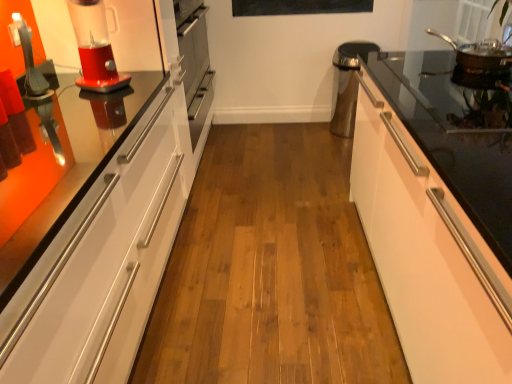
Question: From the image's perspective, is translucent plastic blender at left over stainless steel frying pan at upper right?

Choices:
 (A) no
 (B) yes

Answer: (A)

Question: Is translucent plastic blender at left behind stainless steel frying pan at upper right?

Choices:
 (A) no
 (B) yes

Answer: (A)

Question: Is translucent plastic blender at left to the left of stainless steel frying pan at upper right from the viewer's perspective?

Choices:
 (A) no
 (B) yes

Answer: (B)

Question: Considering the relative sizes of translucent plastic blender at left and stainless steel frying pan at upper right in the image provided, is translucent plastic blender at left taller than stainless steel frying pan at upper right?

Choices:
 (A) yes
 (B) no

Answer: (A)

Question: From a real-world perspective, is translucent plastic blender at left physically below stainless steel frying pan at upper right?

Choices:
 (A) yes
 (B) no

Answer: (B)

Question: Can you confirm if translucent plastic blender at left is wider than stainless steel frying pan at upper right?

Choices:
 (A) yes
 (B) no

Answer: (B)

Question: Is black matte bulletin board at upper center next to translucent plastic blender at left?

Choices:
 (A) no
 (B) yes

Answer: (A)

Question: Can you confirm if black matte bulletin board at upper center is bigger than translucent plastic blender at left?

Choices:
 (A) no
 (B) yes

Answer: (A)

Question: Is black matte bulletin board at upper center at the right side of translucent plastic blender at left?

Choices:
 (A) yes
 (B) no

Answer: (A)

Question: Is the position of black matte bulletin board at upper center more distant than that of translucent plastic blender at left?

Choices:
 (A) yes
 (B) no

Answer: (A)

Question: Does black matte bulletin board at upper center have a smaller size compared to translucent plastic blender at left?

Choices:
 (A) yes
 (B) no

Answer: (A)

Question: From a real-world perspective, does black matte bulletin board at upper center sit lower than translucent plastic blender at left?

Choices:
 (A) yes
 (B) no

Answer: (A)

Question: Does stainless steel frying pan at upper right have a lesser height compared to white glossy cabinet at right?

Choices:
 (A) yes
 (B) no

Answer: (A)